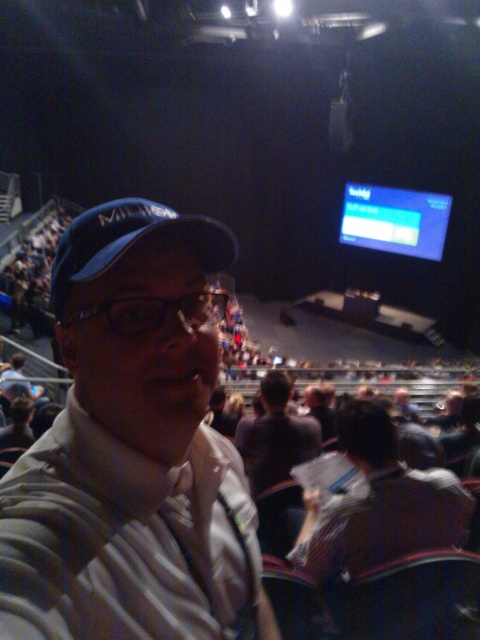
Who is more distant from viewer, (375,488) or (351,200)?

Positioned behind is point (351,200).

Does striped fabric shirt at center appear under matte blue screen at upper right?

Yes.

Is point (342, 516) farther from camera compared to point (349, 204)?

That is False.

Locate an element on the screen. This screenshot has width=480, height=640. striped fabric shirt at center is located at coordinates tap(379, 502).

The image size is (480, 640). What do you see at coordinates (395, 220) in the screenshot? I see `matte blue screen at upper right` at bounding box center [395, 220].

Is matte blue screen at upper right smaller than dark brown shirt at center?

No.

Describe the element at coordinates (395, 220) in the screenshot. I see `matte blue screen at upper right` at that location.

In order to click on matte blue screen at upper right in this screenshot , I will do `click(395, 220)`.

Does striped cotton shirt at center come behind matte blue screen at upper right?

That is False.

From the picture: Between striped cotton shirt at center and matte blue screen at upper right, which one has more height?

Standing taller between the two is matte blue screen at upper right.

What are the coordinates of `striped cotton shirt at center` in the screenshot? It's located at (132, 449).